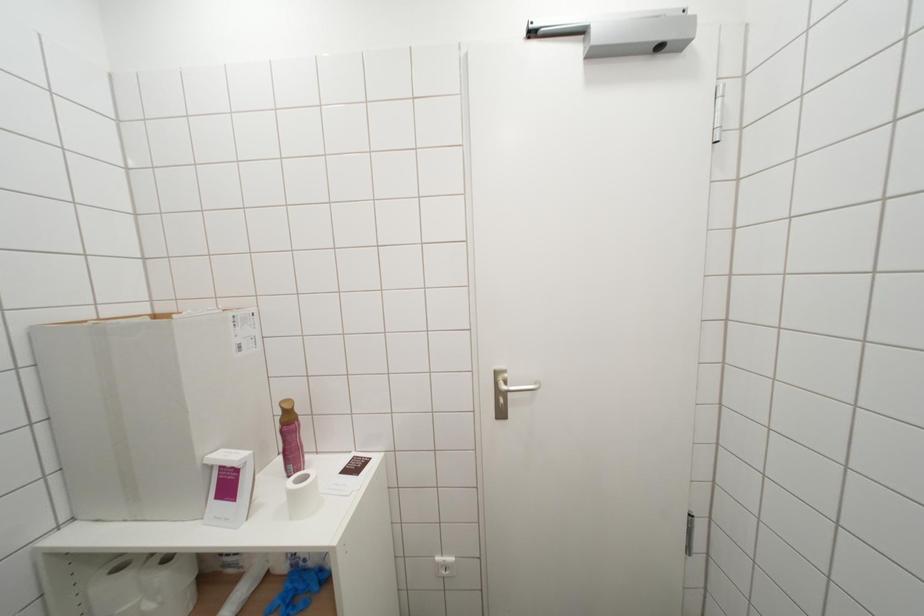
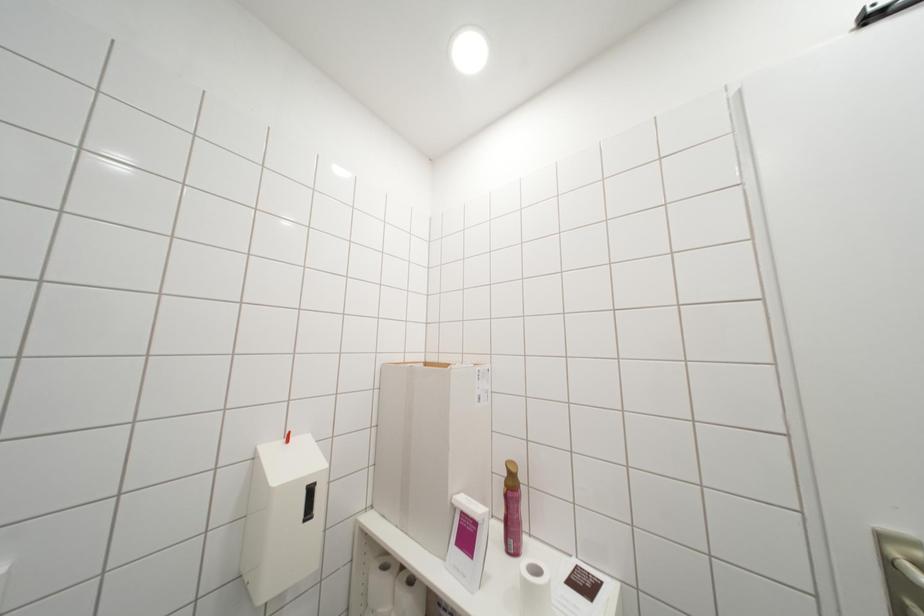
Question: Based on the continuous images, in which direction is the camera rotating? Reply with the corresponding letter.

Choices:
 (A) Left
 (B) Right
 (C) Up
 (D) Down

Answer: (A)